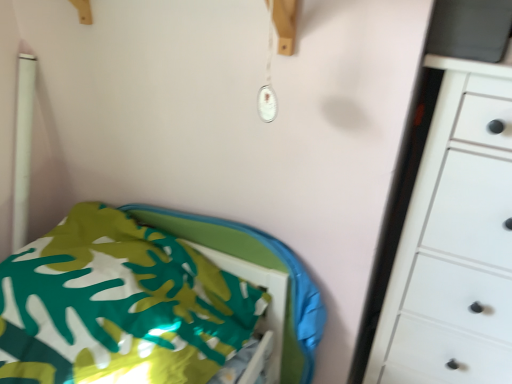
At what (x,y) coordinates should I click in order to perform the action: click on green fabric bed at lower left. Please return your answer as a coordinate pair (x, y). This screenshot has width=512, height=384. Looking at the image, I should click on (119, 305).

Describe the element at coordinates (119, 305) in the screenshot. This screenshot has width=512, height=384. I see `green fabric bed at lower left` at that location.

Find the location of a particular element. The height and width of the screenshot is (384, 512). white matte chest of drawers at right is located at coordinates (454, 242).

Describe the element at coordinates (454, 242) in the screenshot. I see `white matte chest of drawers at right` at that location.

Measure the distance between white matte chest of drawers at right and camera.

The distance of white matte chest of drawers at right from camera is 32.66 inches.

The width and height of the screenshot is (512, 384). I want to click on green fabric bed at lower left, so click(x=119, y=305).

Which object is positioned more to the right, white matte chest of drawers at right or green fabric bed at lower left?

From the viewer's perspective, white matte chest of drawers at right appears more on the right side.

Considering the positions of objects white matte chest of drawers at right and green fabric bed at lower left in the image provided, who is in front, white matte chest of drawers at right or green fabric bed at lower left?

white matte chest of drawers at right is in front.

Is point (453, 373) closer or farther from the camera than point (142, 297)?

Point (453, 373) appears to be farther away from the viewer than point (142, 297).

From the image's perspective, is white matte chest of drawers at right positioned above or below green fabric bed at lower left?

white matte chest of drawers at right is above green fabric bed at lower left.

From a real-world perspective, is white matte chest of drawers at right above or below green fabric bed at lower left?

From a real-world perspective, white matte chest of drawers at right is physically above green fabric bed at lower left.

Between white matte chest of drawers at right and green fabric bed at lower left, which one has larger width?

green fabric bed at lower left.

In terms of height, does white matte chest of drawers at right look taller or shorter compared to green fabric bed at lower left?

In the image, white matte chest of drawers at right appears to be taller than green fabric bed at lower left.

Is white matte chest of drawers at right bigger than green fabric bed at lower left?

Correct, white matte chest of drawers at right is larger in size than green fabric bed at lower left.

Is white matte chest of drawers at right situated inside green fabric bed at lower left or outside?

white matte chest of drawers at right is not enclosed by green fabric bed at lower left.

Is white matte chest of drawers at right next to green fabric bed at lower left and touching it?

white matte chest of drawers at right and green fabric bed at lower left are not in contact.

Does white matte chest of drawers at right turn towards green fabric bed at lower left?

No, white matte chest of drawers at right is not turned towards green fabric bed at lower left.

Consider the image. What's the angular difference between white matte chest of drawers at right and green fabric bed at lower left's facing directions?

1.24 degrees.

Consider the image. How much distance is there between white matte chest of drawers at right and green fabric bed at lower left?

white matte chest of drawers at right and green fabric bed at lower left are 22.61 inches apart from each other.

Where is `furniture that is on the left side of white matte chest of drawers at right`? furniture that is on the left side of white matte chest of drawers at right is located at coordinates (119, 305).

Is green fabric bed at lower left at the right side of white matte chest of drawers at right?

In fact, green fabric bed at lower left is to the left of white matte chest of drawers at right.

Is green fabric bed at lower left in front of white matte chest of drawers at right?

No, it is not.

Considering the positions of point (24, 366) and point (464, 376), is point (24, 366) closer or farther from the camera than point (464, 376)?

Clearly, point (24, 366) is closer to the camera than point (464, 376).

Consider the image. From the image's perspective, does green fabric bed at lower left appear higher than white matte chest of drawers at right?

No.

From a real-world perspective, between green fabric bed at lower left and white matte chest of drawers at right, who is vertically lower?

green fabric bed at lower left, from a real-world perspective.

Looking at this image, which of these two, green fabric bed at lower left or white matte chest of drawers at right, is thinner?

Thinner between the two is white matte chest of drawers at right.

Is green fabric bed at lower left taller or shorter than white matte chest of drawers at right?

Clearly, green fabric bed at lower left is shorter compared to white matte chest of drawers at right.

Which of these two, green fabric bed at lower left or white matte chest of drawers at right, is bigger?

With larger size is white matte chest of drawers at right.

Is green fabric bed at lower left not inside white matte chest of drawers at right?

Indeed, green fabric bed at lower left is completely outside white matte chest of drawers at right.

Is green fabric bed at lower left not close to white matte chest of drawers at right?

green fabric bed at lower left is near white matte chest of drawers at right, not far away.

Could you tell me if green fabric bed at lower left is facing white matte chest of drawers at right?

No, green fabric bed at lower left is not oriented towards white matte chest of drawers at right.

Can you tell me how much green fabric bed at lower left and white matte chest of drawers at right differ in facing direction?

The facing directions of green fabric bed at lower left and white matte chest of drawers at right are 1.24 degrees apart.

Locate an element on the screen. chest of drawers that appears on the right of green fabric bed at lower left is located at coordinates (454, 242).

I want to click on chest of drawers on the right of green fabric bed at lower left, so click(x=454, y=242).

Where is `the chest of drawers positioned vertically above the green fabric bed at lower left (from a real-world perspective)`? the chest of drawers positioned vertically above the green fabric bed at lower left (from a real-world perspective) is located at coordinates (454, 242).